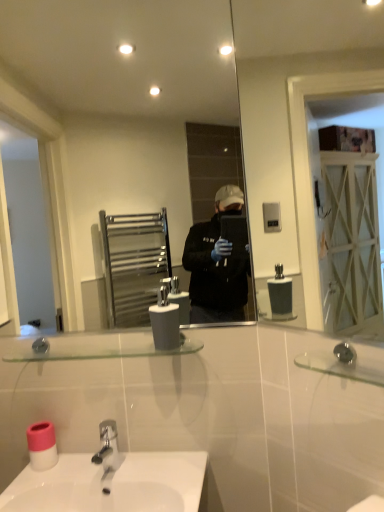
Question: Which direction should I rotate to look at clear glass mirror at center, which appears as the 2th mirror when viewed from the front?

Choices:
 (A) right
 (B) left

Answer: (B)

Question: Considering the relative sizes of clear glass mirror at center, the 1th mirror positioned from the left, and clear glass mirror at upper right, placed as the 1th mirror when sorted from right to left, in the image provided, is clear glass mirror at center, the 1th mirror positioned from the left, taller than clear glass mirror at upper right, placed as the 1th mirror when sorted from right to left,?

Choices:
 (A) no
 (B) yes

Answer: (B)

Question: Is clear glass mirror at center, positioned as the first mirror in back-to-front order, to the right of clear glass mirror at upper right, placed as the 1th mirror when sorted from right to left, from the viewer's perspective?

Choices:
 (A) no
 (B) yes

Answer: (A)

Question: From the image's perspective, does clear glass mirror at center, the 1th mirror positioned from the left, appear lower than clear glass mirror at upper right, placed as the 1th mirror when sorted from right to left?

Choices:
 (A) no
 (B) yes

Answer: (A)

Question: Considering the relative positions of clear glass mirror at center, acting as the 2th mirror starting from the right, and clear glass mirror at upper right, placed as the 1th mirror when sorted from right to left, in the image provided, is clear glass mirror at center, acting as the 2th mirror starting from the right, to the left of clear glass mirror at upper right, placed as the 1th mirror when sorted from right to left, from the viewer's perspective?

Choices:
 (A) no
 (B) yes

Answer: (B)

Question: From a real-world perspective, does clear glass mirror at center, the 1th mirror positioned from the left, stand above clear glass mirror at upper right, placed as the 1th mirror when sorted from right to left?

Choices:
 (A) yes
 (B) no

Answer: (A)

Question: From a real-world perspective, is clear glass mirror at center, acting as the 2th mirror starting from the right, physically below clear glass mirror at upper right, placed as the 1th mirror when sorted from right to left?

Choices:
 (A) no
 (B) yes

Answer: (A)

Question: Does pink plastic toilet paper at lower left contain clear glass shelf at center?

Choices:
 (A) no
 (B) yes

Answer: (A)

Question: Is pink plastic toilet paper at lower left positioned with its back to clear glass shelf at center?

Choices:
 (A) yes
 (B) no

Answer: (B)

Question: Considering the relative positions of pink plastic toilet paper at lower left and clear glass shelf at center in the image provided, is pink plastic toilet paper at lower left to the left of clear glass shelf at center from the viewer's perspective?

Choices:
 (A) no
 (B) yes

Answer: (B)

Question: Could you tell me if pink plastic toilet paper at lower left is facing clear glass shelf at center?

Choices:
 (A) no
 (B) yes

Answer: (A)

Question: Is pink plastic toilet paper at lower left bigger than clear glass shelf at center?

Choices:
 (A) yes
 (B) no

Answer: (B)

Question: From the image's perspective, is pink plastic toilet paper at lower left below clear glass shelf at center?

Choices:
 (A) no
 (B) yes

Answer: (B)

Question: From the image's perspective, is clear glass mirror at upper right, which is counted as the 1th mirror, starting from the front, above clear glass shelf at center?

Choices:
 (A) yes
 (B) no

Answer: (A)